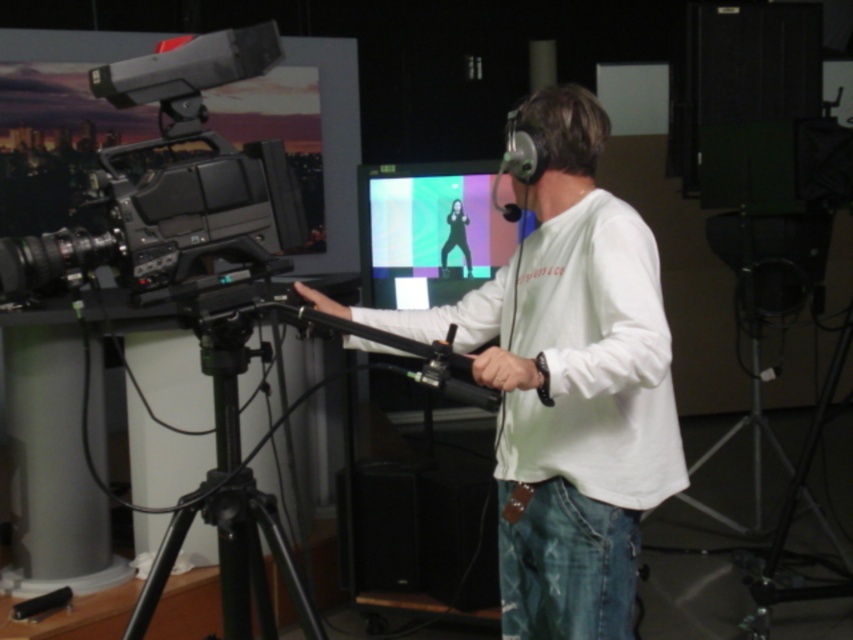
Describe the element at coordinates (170, 180) in the screenshot. I see `matte black camera at left` at that location.

Who is higher up, matte black camera at left or black metal tripod at center?

matte black camera at left is higher up.

Is point (210, 40) behind point (769, 435)?

No, it is not.

Identify the location of matte black camera at left. (170, 180).

Is point (218, 49) farther from camera compared to point (495, 214)?

No.

Is matte black camera at left wider than matte plastic monitor at center?

In fact, matte black camera at left might be narrower than matte plastic monitor at center.

Where is `matte black camera at left`? matte black camera at left is located at coordinates (170, 180).

How much distance is there between black metal tripod at left and matte plastic monitor at center?

A distance of 3.89 feet exists between black metal tripod at left and matte plastic monitor at center.

Is black metal tripod at left shorter than matte plastic monitor at center?

No, black metal tripod at left is not shorter than matte plastic monitor at center.

This screenshot has height=640, width=853. Describe the element at coordinates (230, 512) in the screenshot. I see `black metal tripod at left` at that location.

At what (x,y) coordinates should I click in order to perform the action: click on black metal tripod at left. Please return your answer as a coordinate pair (x, y). The height and width of the screenshot is (640, 853). Looking at the image, I should click on (230, 512).